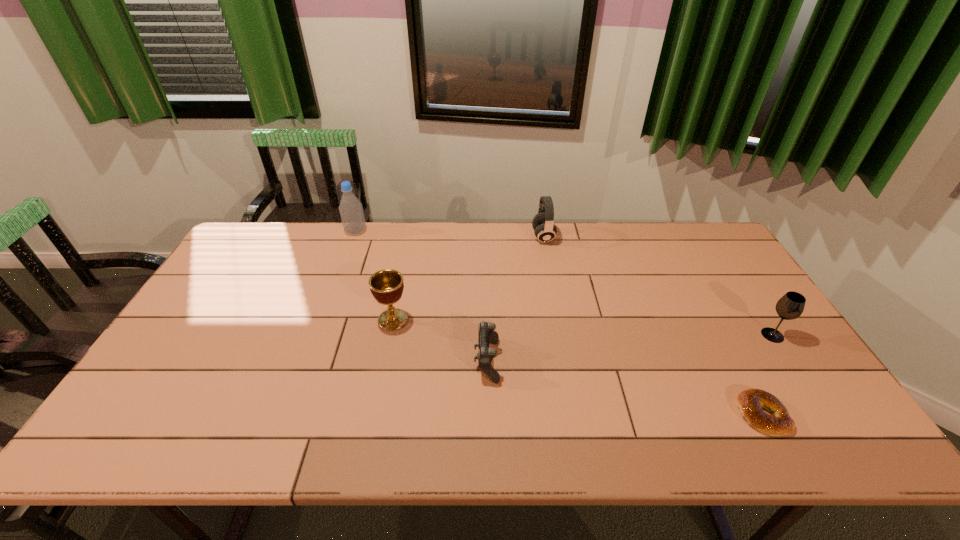
Where is `bottle`? The height and width of the screenshot is (540, 960). bottle is located at coordinates (351, 211).

In order to click on the leftmost object in this screenshot , I will do `click(351, 211)`.

The width and height of the screenshot is (960, 540). I want to click on the third object from right to left, so click(x=543, y=223).

Find the location of a particular element. The width and height of the screenshot is (960, 540). the second object from left to right is located at coordinates tap(386, 286).

Image resolution: width=960 pixels, height=540 pixels. Find the location of `the rightmost object`. the rightmost object is located at coordinates (790, 306).

The height and width of the screenshot is (540, 960). Identify the location of the fourth object from right to left. (486, 335).

The width and height of the screenshot is (960, 540). I want to click on the fifth tallest object, so click(486, 335).

Identify the location of bagel. (751, 402).

Locate an element on the screen. Image resolution: width=960 pixels, height=540 pixels. the nearest object is located at coordinates (751, 402).

The width and height of the screenshot is (960, 540). I want to click on free space located on the right of the bottle, so click(397, 231).